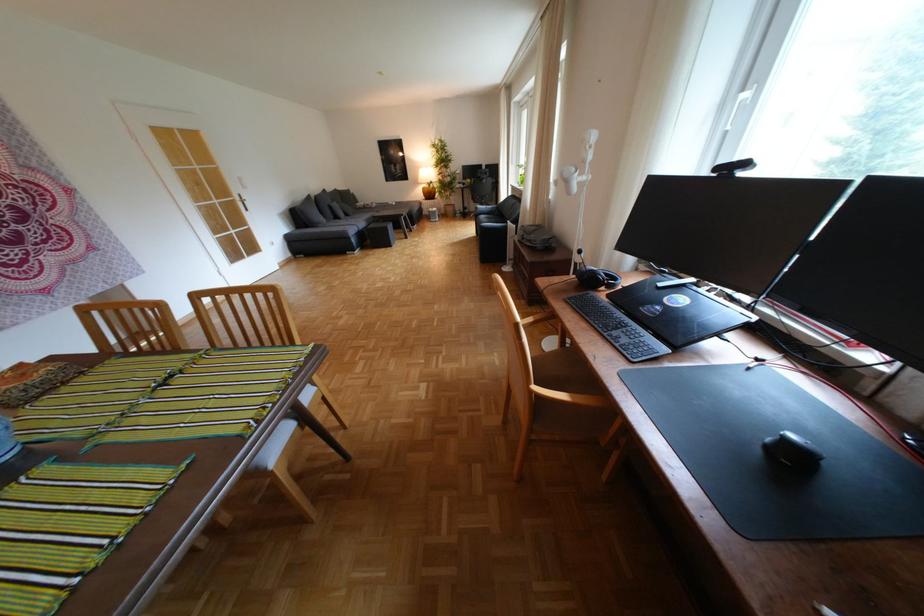
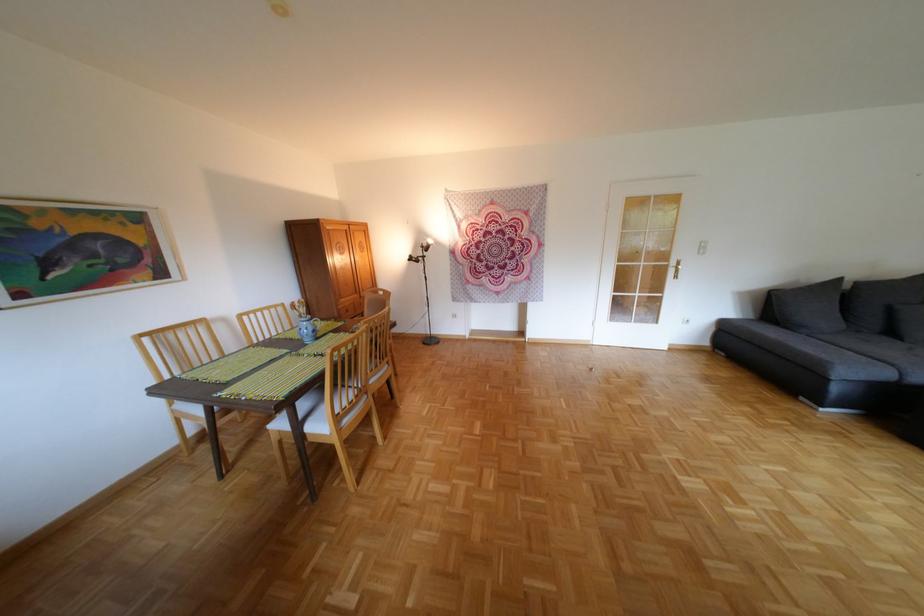
Find the pixel in the second image that matches (247,200) in the first image.

(679, 265)